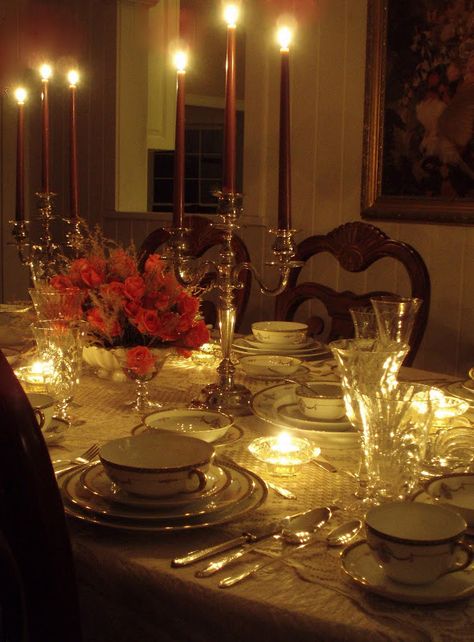
What are the coordinates of `goblets` in the screenshot? It's located at (69, 367), (57, 307), (389, 306), (364, 320), (365, 367), (381, 399), (452, 447).